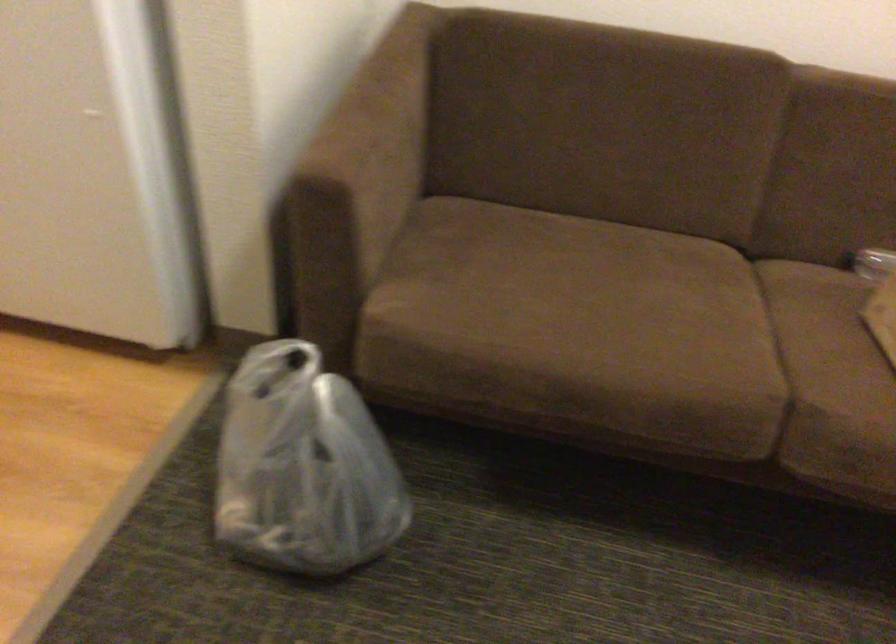
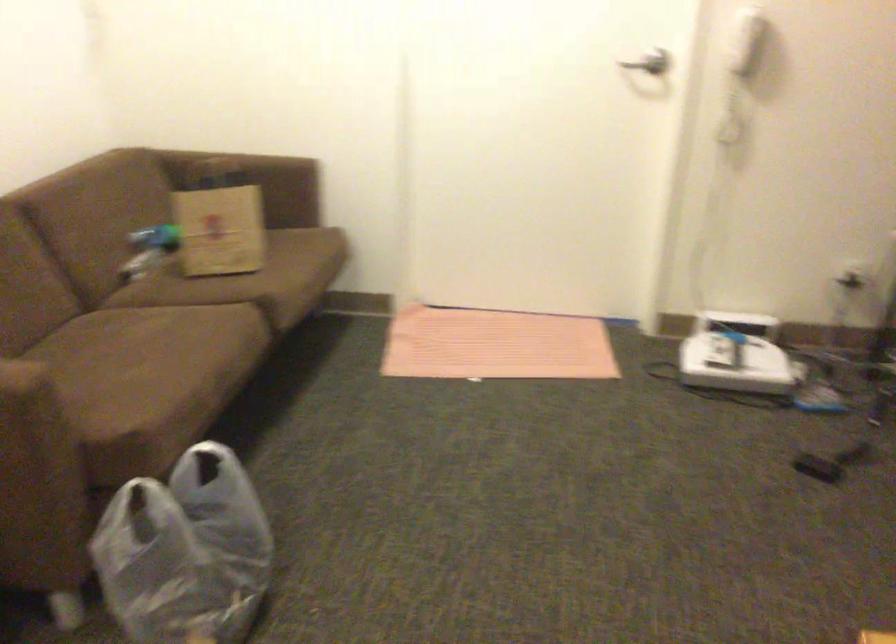
The point at (476, 301) is marked in the first image. Where is the corresponding point in the second image?

(110, 402)